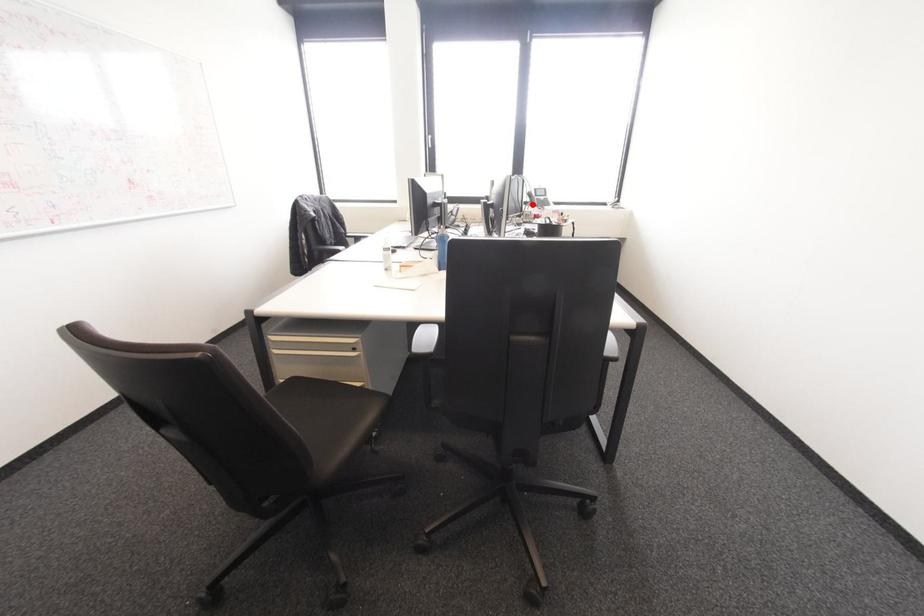
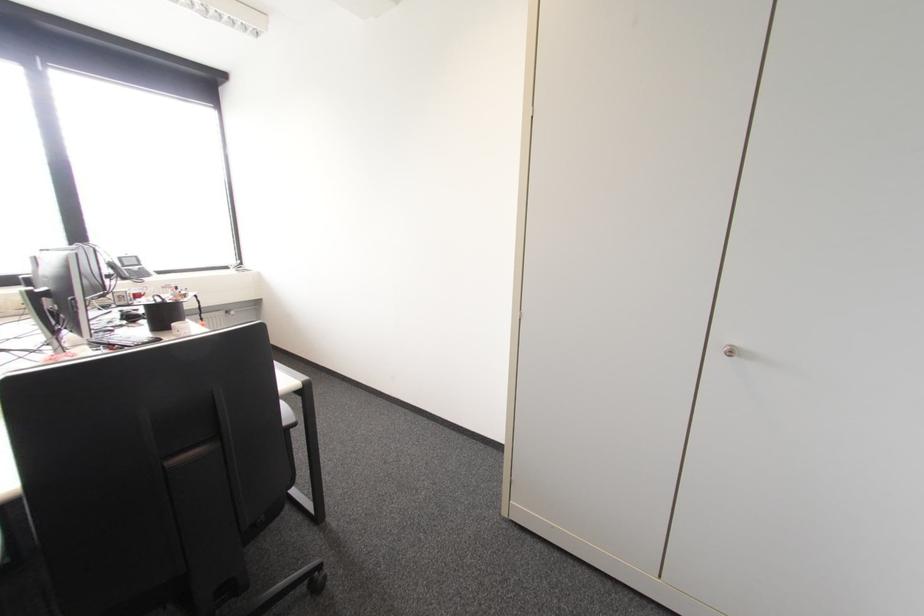
Question: I am providing you with two images of the same scene from different viewpoints. Image1 has a red point marked. In image2, the corresponding 3D location appears at what relative position? Reply with the corresponding letter.

Choices:
 (A) Closer
 (B) Farther

Answer: (B)